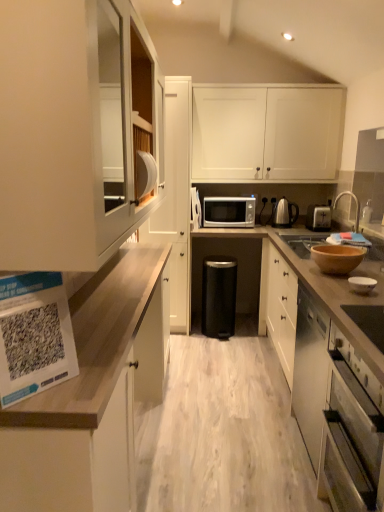
Question: In the image, is silver metallic microwave at center on the left side or the right side of brown matte bowl at right?

Choices:
 (A) right
 (B) left

Answer: (B)

Question: Based on their sizes in the image, would you say silver metallic microwave at center is bigger or smaller than brown matte bowl at right?

Choices:
 (A) small
 (B) big

Answer: (B)

Question: Estimate the real-world distances between objects in this image. Which object is closer to the silver metallic toaster at right?

Choices:
 (A) white matte cabinet at upper left, which is counted as the fourth cabinetry, starting from the right
 (B) wooden bowl at right, which is counted as the 2th bowl, starting from the front
 (C) wooden countertop at left, positioned as the second cabinetry in left-to-right order
 (D) white matte cabinet at upper left, which ranks as the 3th cabinetry in left-to-right order
 (E) brown matte bowl at right

Answer: (E)

Question: Based on their relative distances, which object is nearer to the wooden bowl at right, the 2th bowl ordered from the bottom?

Choices:
 (A) stainless steel oven at lower right
 (B) white matte cabinet at upper left, the first cabinetry when ordered from left to right
 (C) silver metallic toaster at right
 (D) black matte trash can at center
 (E) white matte cabinet at upper left, placed as the 2th cabinetry when sorted from right to left

Answer: (A)